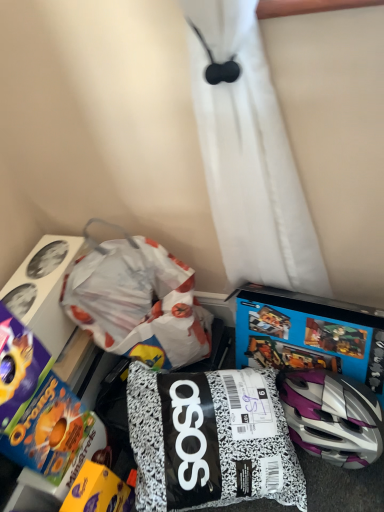
Question: Considering their positions, is white paper bag at center located in front of or behind yellow matte chocolate bar at lower left, positioned as the second toy in right-to-left order?

Choices:
 (A) front
 (B) behind

Answer: (B)

Question: Would you say white paper bag at center is inside or outside yellow matte chocolate bar at lower left, marked as the 2th toy in a left-to-right arrangement?

Choices:
 (A) inside
 (B) outside

Answer: (B)

Question: Estimate the real-world distances between objects in this image. Which object is farther from the yellow matte chocolate bar at lower left, marked as the 2th toy in a left-to-right arrangement?

Choices:
 (A) blue cardboard video game at lower right
 (B) white paper bag at center
 (C) blue cardboard cereal box at lower left, positioned as the third toy in right-to-left order
 (D) black and white speckled bag at center, which is counted as the 3th toy, starting from the left

Answer: (A)

Question: Which object is positioned farthest from the yellow matte chocolate bar at lower left, marked as the 2th toy in a left-to-right arrangement?

Choices:
 (A) blue cardboard video game at lower right
 (B) blue cardboard cereal box at lower left, the 1th toy when ordered from left to right
 (C) white paper bag at center
 (D) black and white speckled bag at center, which is the 1th toy in right-to-left order

Answer: (A)